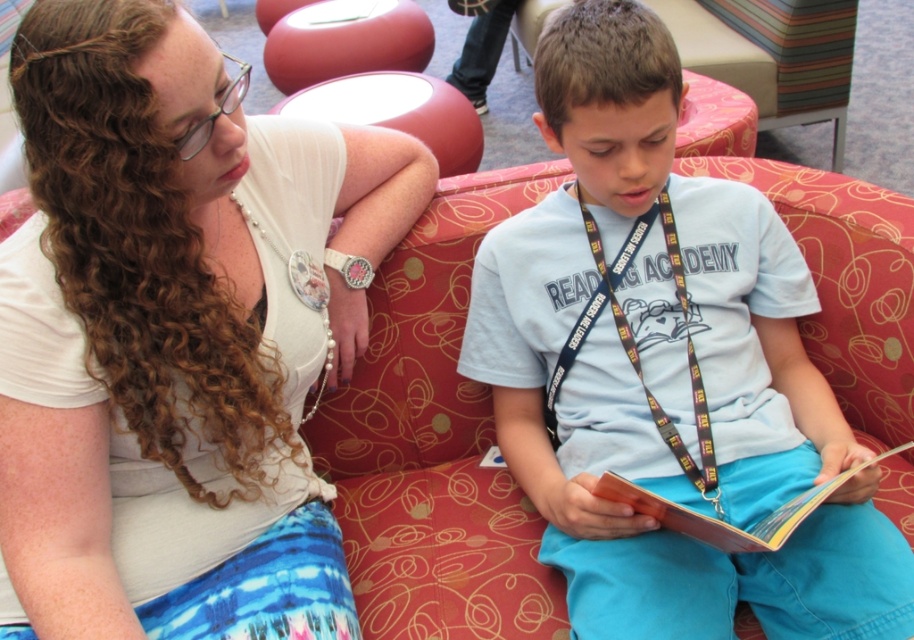
You are a photographer setting up a shoot in this room. You need to ensure that the white matte tank top at upper left and the black fabric lanyard at center are both visible in the frame. Based on their positions, which object is closer to the camera?

The white matte tank top at upper left is in front of the black fabric lanyard at center, so it is closer to the camera.

Consider the image. You are a tailor who needs to place both the light blue cotton shirt at center and the hardcover book at center on a shelf that can only hold items up to the size of the larger one. Which item determines the maximum size the shelf can hold?

The light blue cotton shirt at center has a larger size compared to the hardcover book at center, so the shelf must be able to hold at least the size of the light blue cotton shirt at center.